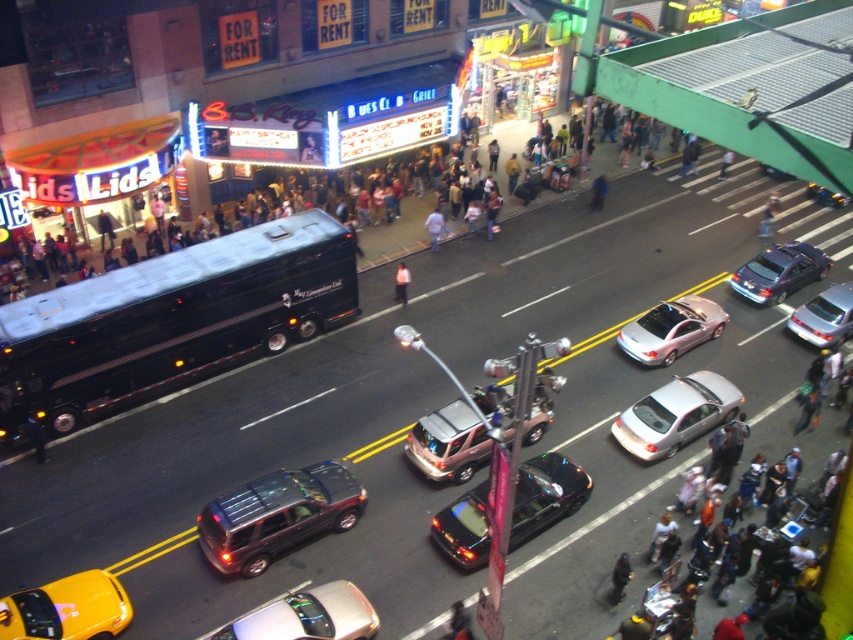
You are a delivery driver navigating the busy street in the image. You need to deliver a package to a location near the point at coordinates (438, 220). While driving, you notice another vehicle approaching from the direction of the point at (718, 177). Based on their relative positions, which direction should you turn to avoid collision?

Since point (438, 220) is in front of point (718, 177), the vehicle approaching from (718, 177) is behind you. Therefore, you should continue moving forward to avoid collision.